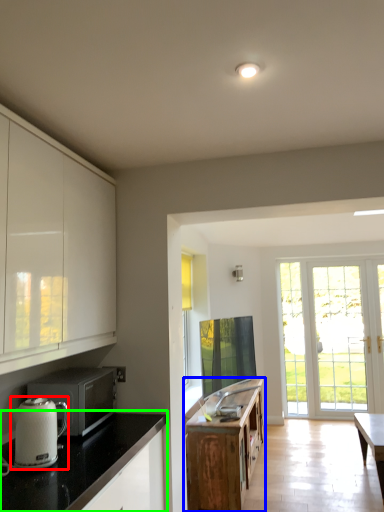
Question: Which object is positioned farthest from kitchen appliance (highlighted by a red box)? Select from cabinetry (highlighted by a blue box) and countertop (highlighted by a green box).

Choices:
 (A) cabinetry
 (B) countertop

Answer: (A)